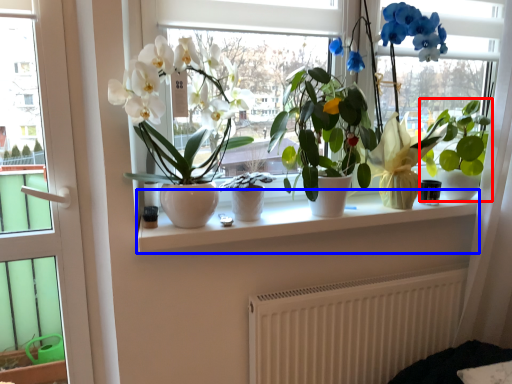
Question: Which object is further to the camera taking this photo, houseplant (highlighted by a red box) or window sill (highlighted by a blue box)?

Choices:
 (A) houseplant
 (B) window sill

Answer: (A)